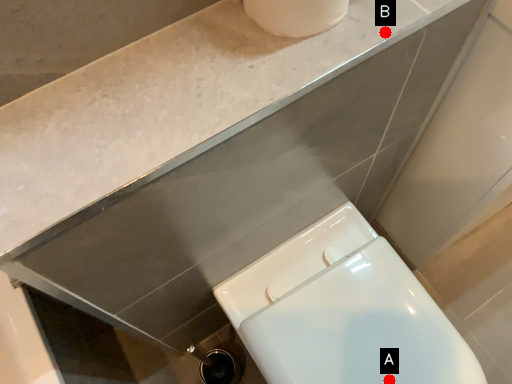
Question: Two points are circled on the image, labeled by A and B beside each circle. Among these points, which one is farthest from the camera?

Choices:
 (A) A is further
 (B) B is further

Answer: (A)